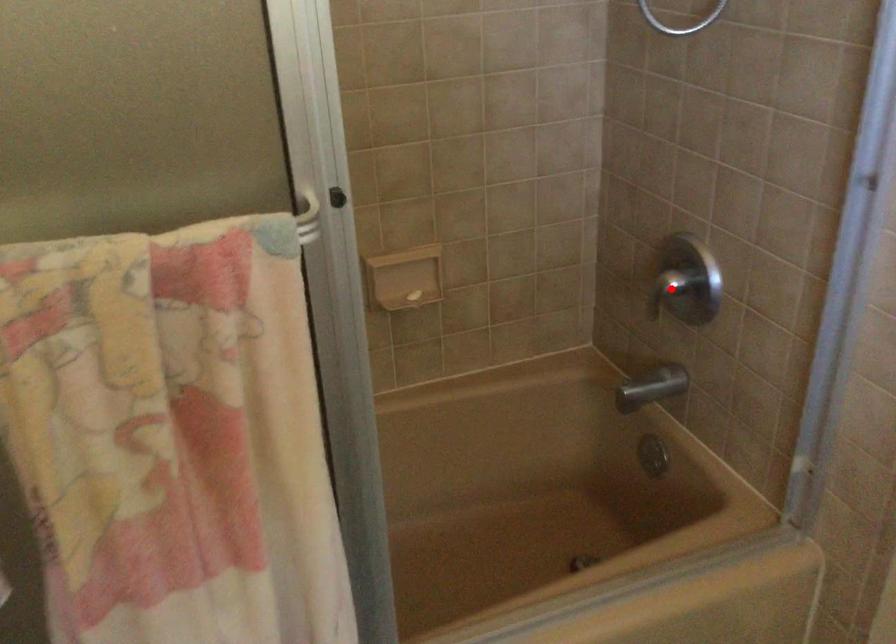
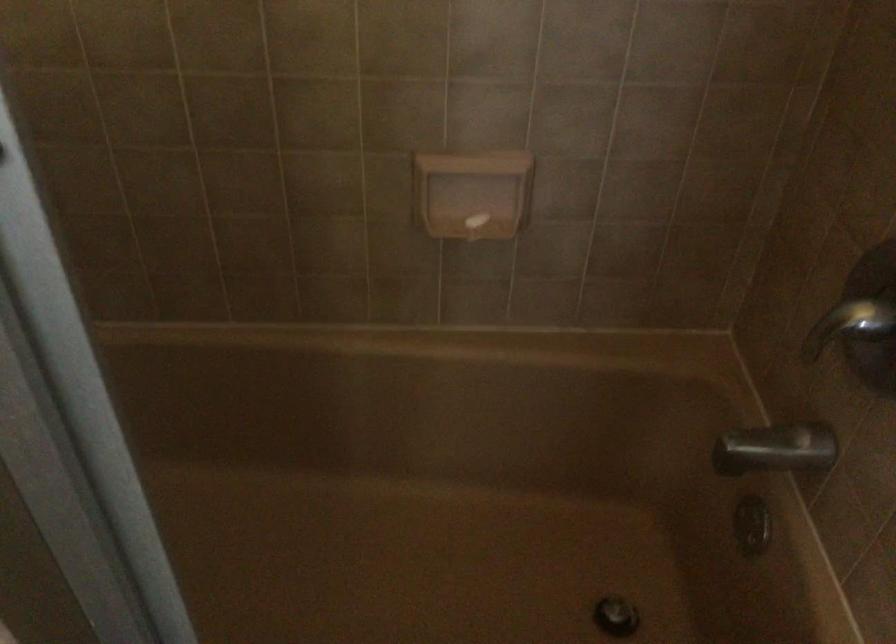
Find the pixel in the second image that matches the highlighted location in the first image.

(849, 325)